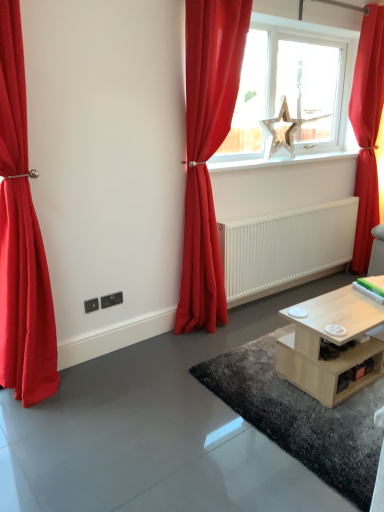
Question: Is matte red curtain at left, the first curtain positioned from the left, thinner than shiny wooden coffee table at lower center?

Choices:
 (A) yes
 (B) no

Answer: (A)

Question: Does matte red curtain at left, the first curtain positioned from the left, have a smaller size compared to shiny wooden coffee table at lower center?

Choices:
 (A) no
 (B) yes

Answer: (A)

Question: Is matte red curtain at left, the first curtain positioned from the left, aimed at shiny wooden coffee table at lower center?

Choices:
 (A) yes
 (B) no

Answer: (B)

Question: Is matte red curtain at left, the 3th curtain from the right, facing away from shiny wooden coffee table at lower center?

Choices:
 (A) no
 (B) yes

Answer: (A)

Question: Can you confirm if matte red curtain at left, the first curtain positioned from the left, is positioned to the left of shiny wooden coffee table at lower center?

Choices:
 (A) no
 (B) yes

Answer: (B)

Question: Is wooden star at center taller or shorter than white glossy radiator at center?

Choices:
 (A) tall
 (B) short

Answer: (A)

Question: From a real-world perspective, is wooden star at center positioned above or below white glossy radiator at center?

Choices:
 (A) above
 (B) below

Answer: (A)

Question: Based on their sizes in the image, would you say wooden star at center is bigger or smaller than white glossy radiator at center?

Choices:
 (A) big
 (B) small

Answer: (A)

Question: Is wooden star at center inside the boundaries of white glossy radiator at center, or outside?

Choices:
 (A) inside
 (B) outside

Answer: (B)

Question: Looking at their shapes, would you say wooden star at center is wider or thinner than white smooth radiator at center?

Choices:
 (A) thin
 (B) wide

Answer: (A)

Question: Considering the positions of wooden star at center and white smooth radiator at center in the image, is wooden star at center taller or shorter than white smooth radiator at center?

Choices:
 (A) tall
 (B) short

Answer: (A)

Question: From a real-world perspective, is wooden star at center positioned above or below white smooth radiator at center?

Choices:
 (A) above
 (B) below

Answer: (A)

Question: Considering their positions, is wooden star at center located in front of or behind white smooth radiator at center?

Choices:
 (A) behind
 (B) front

Answer: (B)

Question: Based on their positions, is matte red curtain at center, the 2th curtain in the left-to-right sequence, located to the left or right of matte red curtain at left, the first curtain positioned from the left?

Choices:
 (A) left
 (B) right

Answer: (B)

Question: Considering their positions, is matte red curtain at center, the 2th curtain in the left-to-right sequence, located in front of or behind matte red curtain at left, the 3th curtain from the right?

Choices:
 (A) front
 (B) behind

Answer: (B)